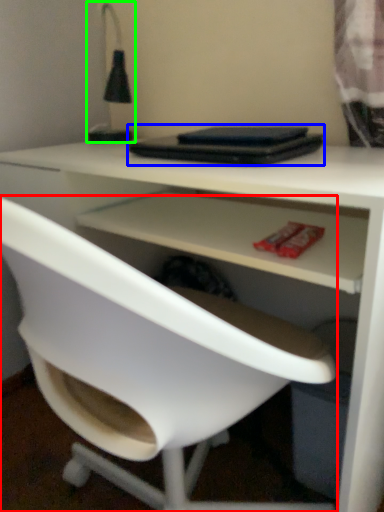
Question: Which object is the closest to the chair (highlighted by a red box)? Choose among these: laptop (highlighted by a blue box) or table lamp (highlighted by a green box).

Choices:
 (A) laptop
 (B) table lamp

Answer: (A)